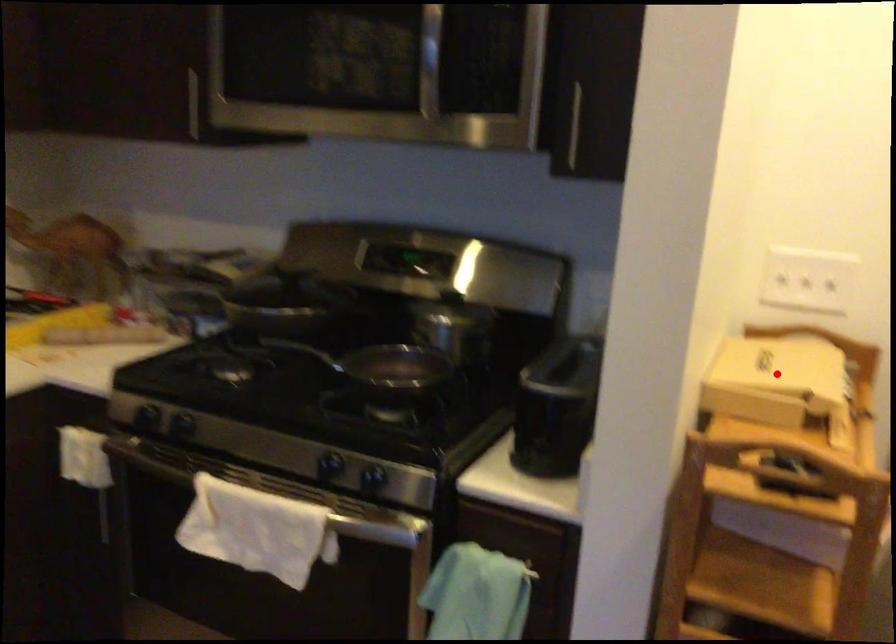
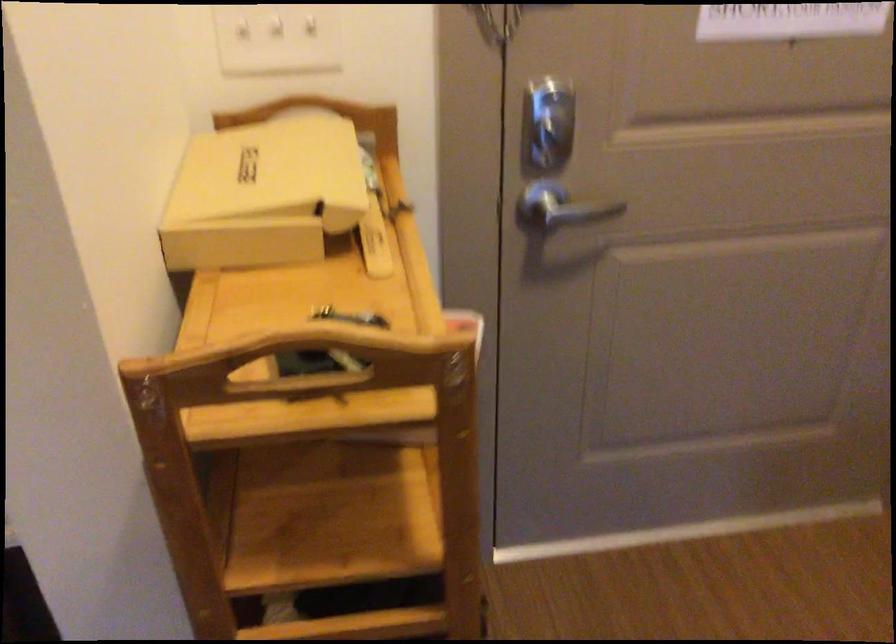
Find the pixel in the second image that matches the highlighted location in the first image.

(263, 194)